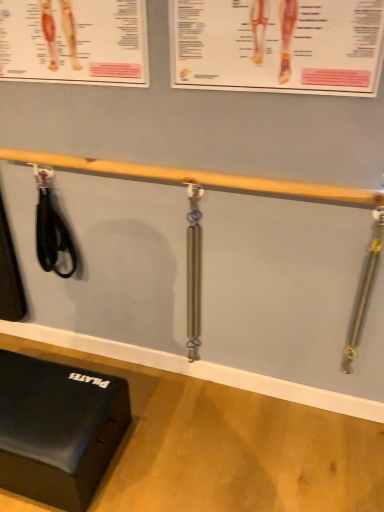
Identify the location of free location to the right of black rubber exercise mat at lower left. (182, 436).